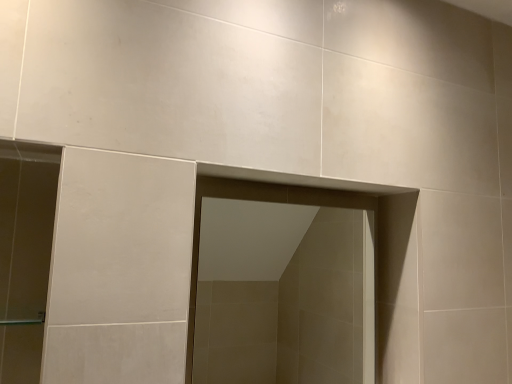
Image resolution: width=512 pixels, height=384 pixels. What do you see at coordinates (281, 285) in the screenshot?
I see `transparent glass door at center` at bounding box center [281, 285].

The image size is (512, 384). I want to click on transparent glass door at center, so click(281, 285).

The image size is (512, 384). Identify the location of transparent glass door at center. (281, 285).